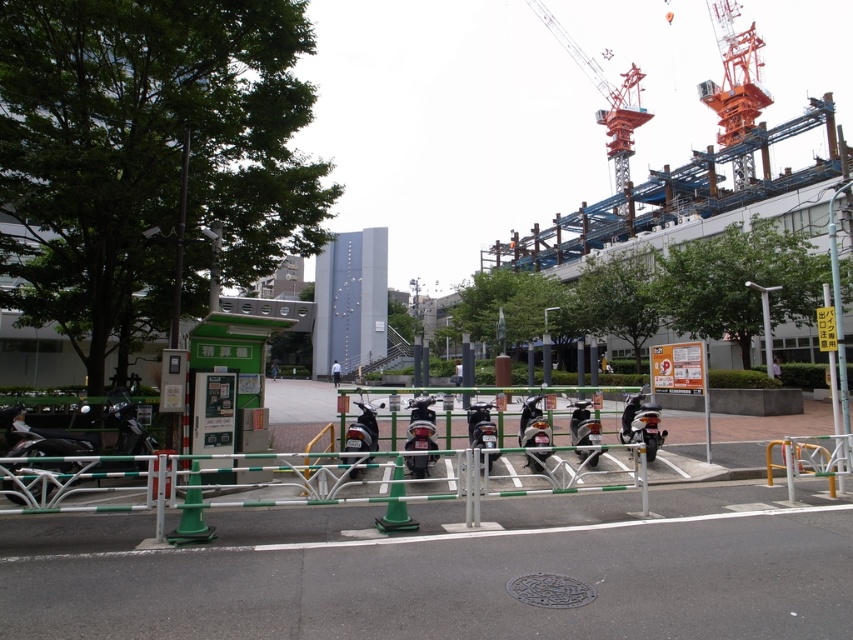
Question: Which point is farther from the camera taking this photo?

Choices:
 (A) (337, 360)
 (B) (648, 113)

Answer: (B)

Question: Does orange metallic crane at upper right appear on the right side of white matte person at center?

Choices:
 (A) no
 (B) yes

Answer: (B)

Question: Is orange metallic crane at upper right smaller than white matte person at center?

Choices:
 (A) no
 (B) yes

Answer: (A)

Question: Among these objects, which one is nearest to the camera?

Choices:
 (A) white matte person at center
 (B) orange metallic crane at upper right

Answer: (A)

Question: Which of the following is the closest to the observer?

Choices:
 (A) (337, 362)
 (B) (556, 20)

Answer: (A)

Question: Is orange metallic crane at upper right wider than white matte person at center?

Choices:
 (A) yes
 (B) no

Answer: (A)